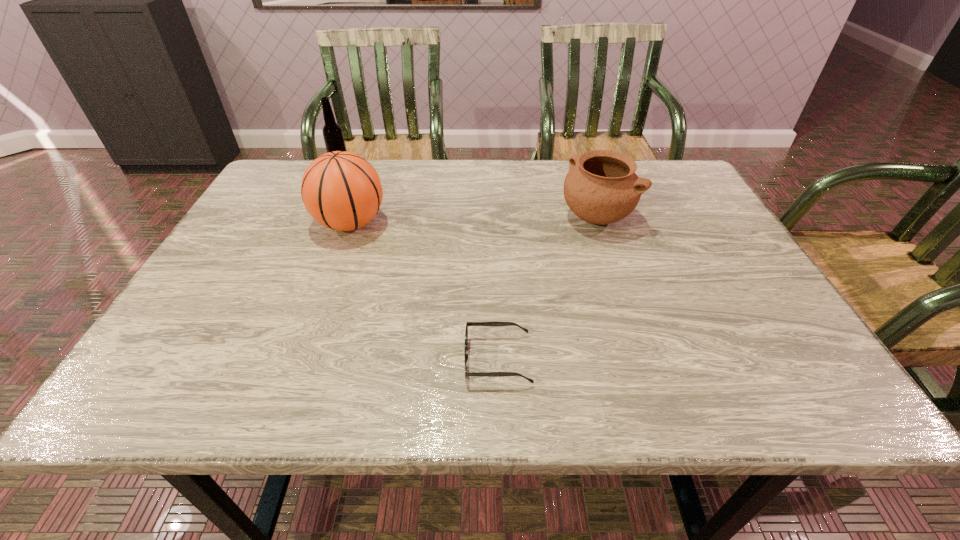
Where is `vacant area that lies between the farthest object and the second shortest object`? The width and height of the screenshot is (960, 540). vacant area that lies between the farthest object and the second shortest object is located at coordinates (468, 192).

Where is `the closest object to the beer bottle`? This screenshot has width=960, height=540. the closest object to the beer bottle is located at coordinates (342, 191).

Point out which object is positioned as the second nearest to the farthest object. Please provide its 2D coordinates. Your answer should be formatted as a tuple, i.e. [(x, y)], where the tuple contains the x and y coordinates of a point satisfying the conditions above.

[(601, 187)]

Find the location of a particular element. Image resolution: width=960 pixels, height=540 pixels. vacant area that satisfies the following two spatial constraints: 1. on the back side of the basketball; 2. on the left side of the second shortest object is located at coordinates (352, 218).